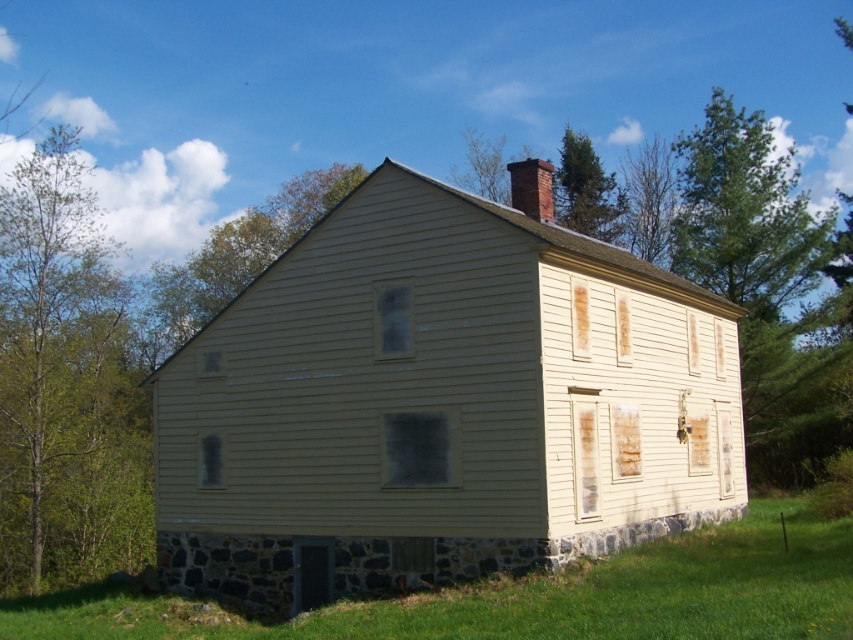
You are standing in front of the house and want to plant a new tree exactly where the green coniferous tree at upper center is currently located. What are the 2D coordinates you should use for planting?

The green coniferous tree at upper center is located at coordinates (585, 189), so you should plant the new tree at those coordinates.

You are standing in front of the two story house and see the smooth brown tree trunk at upper right and the green leafy tree at upper center. Which tree is closer to the right side of the image?

The smooth brown tree trunk at upper right is positioned on the right side of green leafy tree at upper center, so it is closer to the right side of the image.